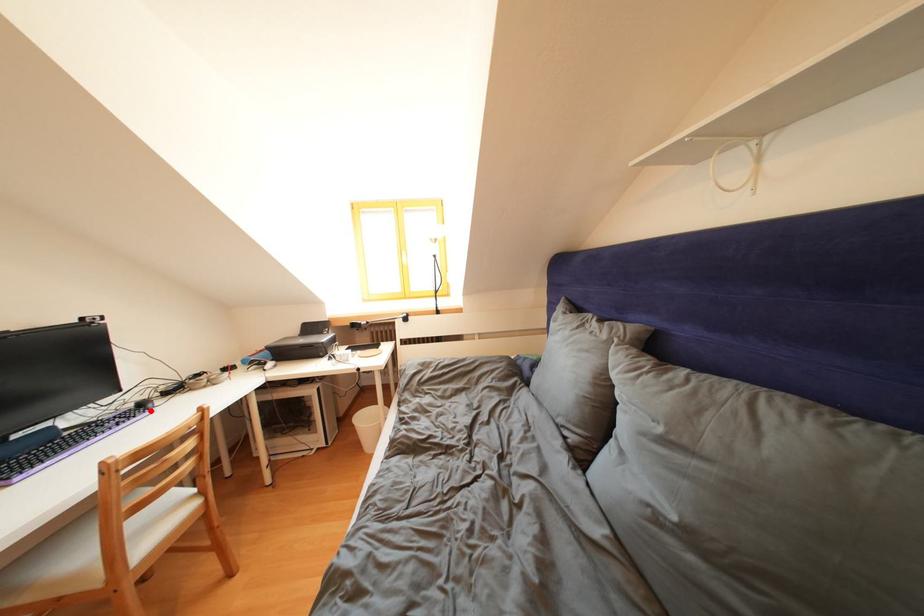
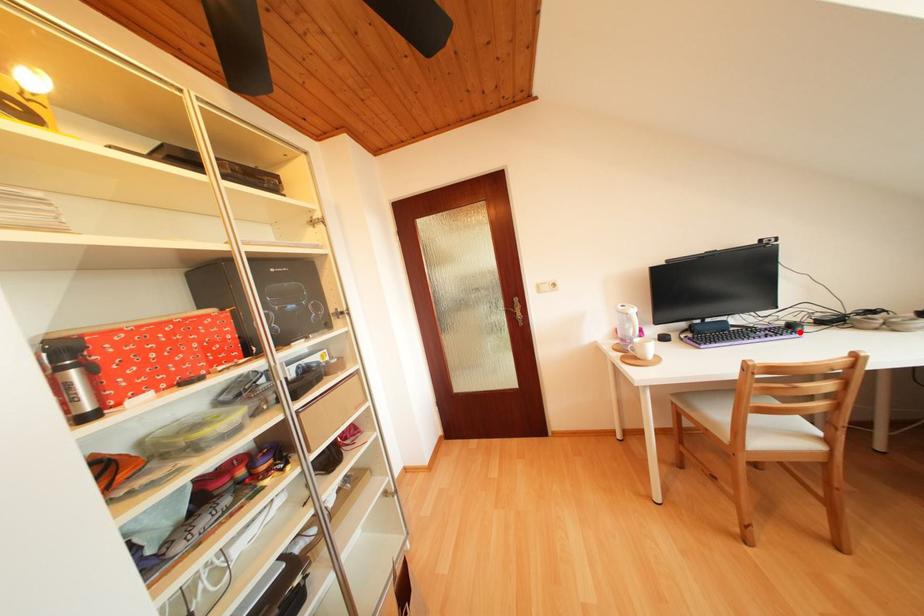
I am providing you with two images of the same scene from different viewpoints. A red point is marked on the first image and another point is marked on the second image. Do the highlighted points in image1 and image2 indicate the same real-world spot?

Yes